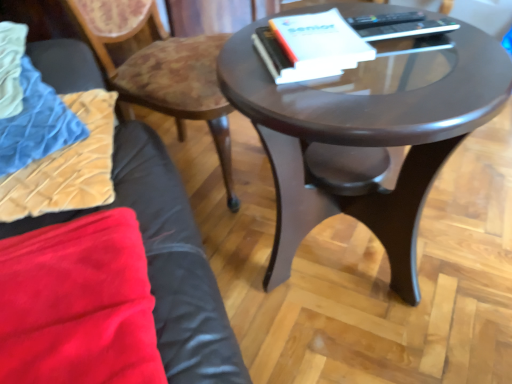
Question: Does velvet beige pillow at lower left turn towards wooden textured chair at upper left?

Choices:
 (A) yes
 (B) no

Answer: (B)

Question: Is velvet beige pillow at lower left outside wooden textured chair at upper left?

Choices:
 (A) no
 (B) yes

Answer: (B)

Question: Is the depth of velvet beige pillow at lower left greater than that of wooden textured chair at upper left?

Choices:
 (A) no
 (B) yes

Answer: (A)

Question: Considering the relative positions of velvet beige pillow at lower left and wooden textured chair at upper left in the image provided, is velvet beige pillow at lower left to the right of wooden textured chair at upper left from the viewer's perspective?

Choices:
 (A) yes
 (B) no

Answer: (B)

Question: Are velvet beige pillow at lower left and wooden textured chair at upper left far apart?

Choices:
 (A) no
 (B) yes

Answer: (A)

Question: Does velvet beige pillow at lower left have a greater width compared to wooden textured chair at upper left?

Choices:
 (A) yes
 (B) no

Answer: (B)

Question: Can you confirm if velvet beige pillow at lower left is thinner than glossy dark wood coffee table at center?

Choices:
 (A) yes
 (B) no

Answer: (A)

Question: From a real-world perspective, is velvet beige pillow at lower left on top of glossy dark wood coffee table at center?

Choices:
 (A) no
 (B) yes

Answer: (B)

Question: Considering the relative positions of velvet beige pillow at lower left and glossy dark wood coffee table at center in the image provided, is velvet beige pillow at lower left to the right of glossy dark wood coffee table at center from the viewer's perspective?

Choices:
 (A) no
 (B) yes

Answer: (A)

Question: From the image's perspective, does velvet beige pillow at lower left appear higher than glossy dark wood coffee table at center?

Choices:
 (A) no
 (B) yes

Answer: (B)

Question: Is velvet beige pillow at lower left wider than glossy dark wood coffee table at center?

Choices:
 (A) no
 (B) yes

Answer: (A)

Question: Can you confirm if velvet beige pillow at lower left is bigger than glossy dark wood coffee table at center?

Choices:
 (A) no
 (B) yes

Answer: (A)

Question: Could you tell me if glossy dark wood coffee table at center is facing velvet blue blanket at left?

Choices:
 (A) yes
 (B) no

Answer: (B)